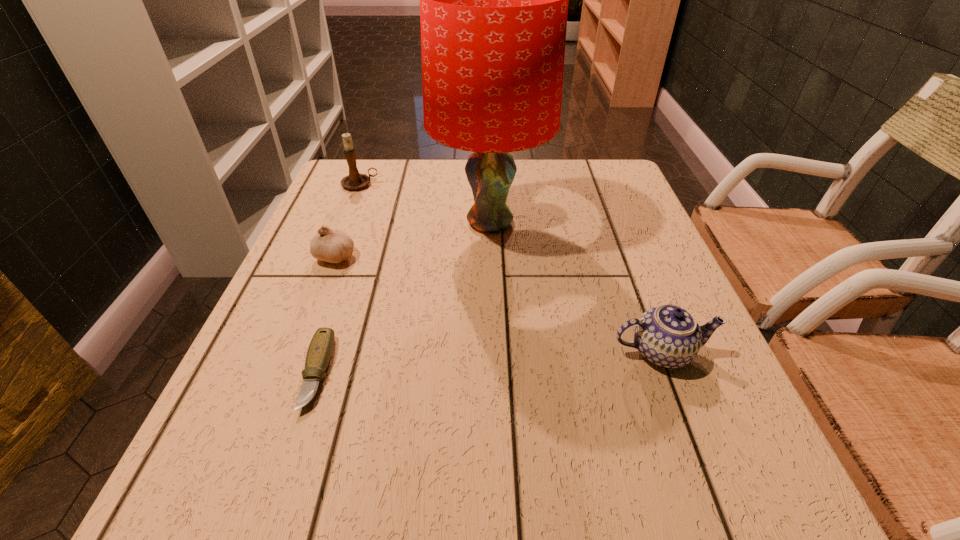
Locate an element on the screen. free space located on the right of the second shortest object is located at coordinates (401, 256).

Identify the location of free space located on the back of the shortest object. point(362,237).

Locate an element on the screen. The image size is (960, 540). lampshade that is at the far edge is located at coordinates (493, 0).

This screenshot has height=540, width=960. Find the location of `candle holder present at the far edge`. candle holder present at the far edge is located at coordinates (354, 181).

Find the location of a particular element. The height and width of the screenshot is (540, 960). candle holder that is at the left edge is located at coordinates (354, 181).

Where is `garlic at the left edge`? The image size is (960, 540). garlic at the left edge is located at coordinates (x=334, y=246).

You are a GUI agent. You are given a task and a screenshot of the screen. Output one action in this format:
    pyautogui.click(x=<x>, y=<y>)
    Task: Click on the pocketknife positioned at the left edge
    This screenshot has width=960, height=540.
    Given the screenshot: What is the action you would take?
    pyautogui.click(x=319, y=353)

Identify the location of object positioned at the right edge. (668, 336).

Locate an element on the screen. object positioned at the far left corner is located at coordinates (354, 181).

Locate an element on the screen. blank area at the far edge is located at coordinates (558, 163).